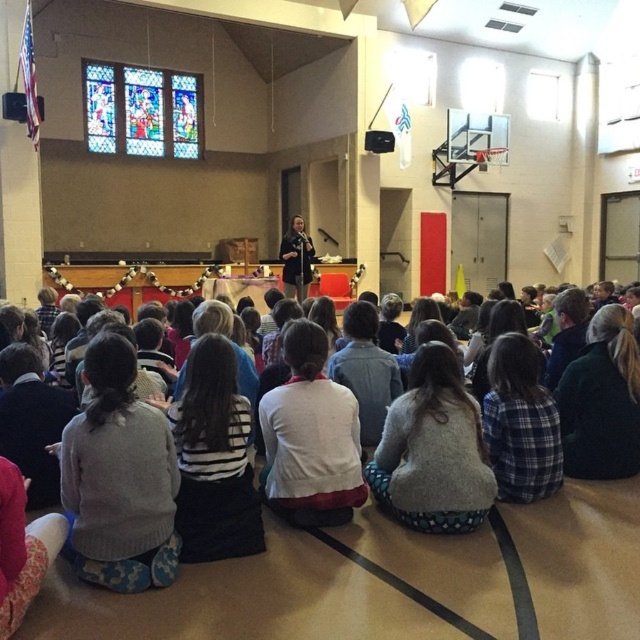
Question: Can you confirm if gray sweater at lower left is thinner than white soft sweater at center?

Choices:
 (A) yes
 (B) no

Answer: (B)

Question: Which point is closer to the camera?

Choices:
 (A) gray sweater at lower left
 (B) plaid fabric shirt at lower right

Answer: (A)

Question: Among these points, which one is nearest to the camera?

Choices:
 (A) [120, 384]
 (B) [554, 468]
 (C) [621, 468]

Answer: (A)

Question: Is white soft sweater at center smaller than dark blue sweater at center?

Choices:
 (A) no
 (B) yes

Answer: (B)

Question: Which point is closer to the camera taking this photo?

Choices:
 (A) (557, 305)
 (B) (64, 477)
 (C) (518, 346)

Answer: (B)

Question: Does plaid fabric shirt at lower right have a greater width compared to dark blue sweater at center?

Choices:
 (A) yes
 (B) no

Answer: (B)